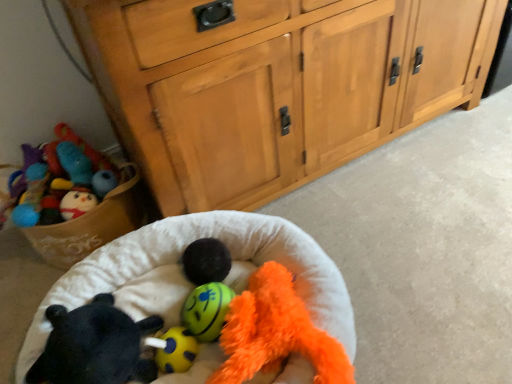
Question: Is fluffy orange stuffed animal at center, the fourth toy when ordered from left to right, wider than yellow rubber ball at center, which is the 2th toy in left-to-right order?

Choices:
 (A) no
 (B) yes

Answer: (B)

Question: Considering the relative positions of fluffy orange stuffed animal at center, which is the first toy from right to left, and yellow rubber ball at center, which is the 2th toy in left-to-right order, in the image provided, is fluffy orange stuffed animal at center, which is the first toy from right to left, behind yellow rubber ball at center, which is the 2th toy in left-to-right order,?

Choices:
 (A) no
 (B) yes

Answer: (A)

Question: From a real-world perspective, is fluffy orange stuffed animal at center, which is the first toy from right to left, over yellow rubber ball at center, which is the 2th toy in left-to-right order?

Choices:
 (A) yes
 (B) no

Answer: (A)

Question: Is fluffy orange stuffed animal at center, the fourth toy when ordered from left to right, smaller than yellow rubber ball at center, which is the 2th toy in left-to-right order?

Choices:
 (A) yes
 (B) no

Answer: (B)

Question: Is fluffy orange stuffed animal at center, which is the first toy from right to left, taller than yellow rubber ball at center, the third toy when ordered from right to left?

Choices:
 (A) yes
 (B) no

Answer: (B)

Question: Can you confirm if yellow rubber ball at center, which is the 3th toy in left-to-right order, is thinner than black fuzzy ball at center?

Choices:
 (A) no
 (B) yes

Answer: (B)

Question: Is yellow rubber ball at center, arranged as the second toy when viewed from the right, outside black fuzzy ball at center?

Choices:
 (A) no
 (B) yes

Answer: (B)

Question: Is yellow rubber ball at center, which is the 3th toy in left-to-right order, further to camera compared to black fuzzy ball at center?

Choices:
 (A) no
 (B) yes

Answer: (A)

Question: Is yellow rubber ball at center, which is the 3th toy in left-to-right order, aimed at black fuzzy ball at center?

Choices:
 (A) no
 (B) yes

Answer: (A)

Question: From the image's perspective, is yellow rubber ball at center, which is the 3th toy in left-to-right order, beneath black fuzzy ball at center?

Choices:
 (A) no
 (B) yes

Answer: (B)

Question: Is black fuzzy ball at center at the back of yellow rubber ball at center, arranged as the second toy when viewed from the right?

Choices:
 (A) no
 (B) yes

Answer: (A)

Question: Can you confirm if black fuzzy ball at center is bigger than yellow rubber ball at center, the third toy when ordered from right to left?

Choices:
 (A) yes
 (B) no

Answer: (A)